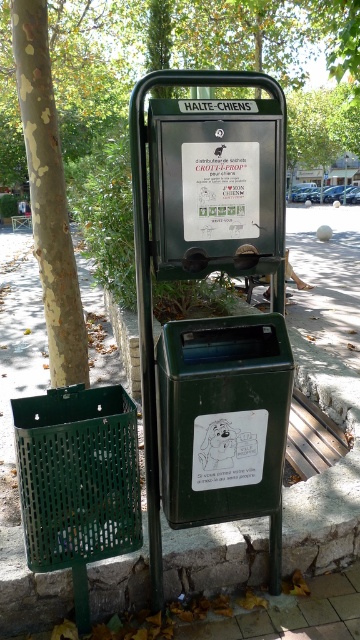
What do you see at coordinates (223, 422) in the screenshot? I see `green matte bin at center` at bounding box center [223, 422].

What do you see at coordinates (223, 422) in the screenshot? I see `green matte bin at center` at bounding box center [223, 422].

This screenshot has height=640, width=360. Find the location of `green matte bin at center`. green matte bin at center is located at coordinates (223, 422).

Does green plastic bus stop at center lie in front of green leafy tree at upper center?

Yes, it is.

From the picture: Who is more forward, (173, 442) or (312, 93)?

Point (173, 442) is in front.

Which is behind, point (240, 227) or point (343, 132)?

The point (343, 132) is behind.

Locate an element on the screen. The width and height of the screenshot is (360, 640). green plastic bus stop at center is located at coordinates (216, 317).

Can you confirm if green plastic pavement at lower center is positioned below white paper sign at center?

Yes.

Who is shorter, green plastic pavement at lower center or white paper sign at center?

white paper sign at center

Is point (222, 576) positioned before point (192, 180)?

No, (222, 576) is further to viewer.

This screenshot has height=640, width=360. What are the coordinates of `green plastic pavement at lower center` in the screenshot? It's located at (326, 385).